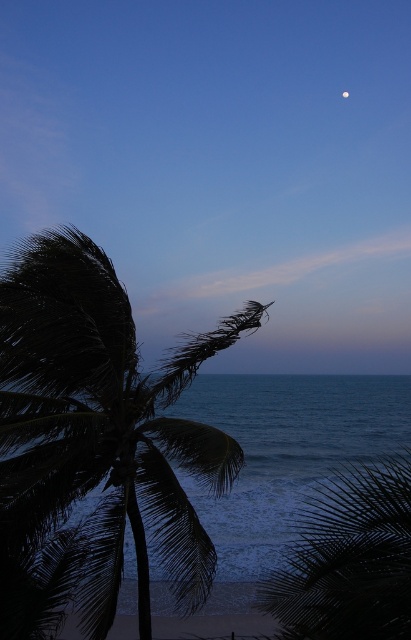
Looking at this image, is dark green leafy palm at left wider than dark green leafy coconut tree at lower right?

Incorrect, dark green leafy palm at left's width does not surpass dark green leafy coconut tree at lower right's.

Is point (145, 456) behind point (371, 467)?

That is False.

Who is more distant from viewer, [73,305] or [316,560]?

Positioned behind is point [73,305].

The image size is (411, 640). What are the coordinates of `dark green leafy palm at left` in the screenshot? It's located at (96, 444).

Does dark green leafy coconut tree at lower right have a smaller size compared to silvery reflective moon at upper right?

No, dark green leafy coconut tree at lower right is not smaller than silvery reflective moon at upper right.

The width and height of the screenshot is (411, 640). In order to click on dark green leafy coconut tree at lower right in this screenshot , I will do `click(348, 557)`.

Is point (358, 636) behind point (343, 92)?

That is False.

Locate an element on the screen. Image resolution: width=411 pixels, height=640 pixels. dark green leafy coconut tree at lower right is located at coordinates (348, 557).

Does dark green leafy palm at left have a lesser width compared to silvery reflective moon at upper right?

Incorrect, dark green leafy palm at left's width is not less than silvery reflective moon at upper right's.

Is dark green leafy palm at left to the right of silvery reflective moon at upper right from the viewer's perspective?

In fact, dark green leafy palm at left is to the left of silvery reflective moon at upper right.

Image resolution: width=411 pixels, height=640 pixels. Find the location of `dark green leafy palm at left`. dark green leafy palm at left is located at coordinates (96, 444).